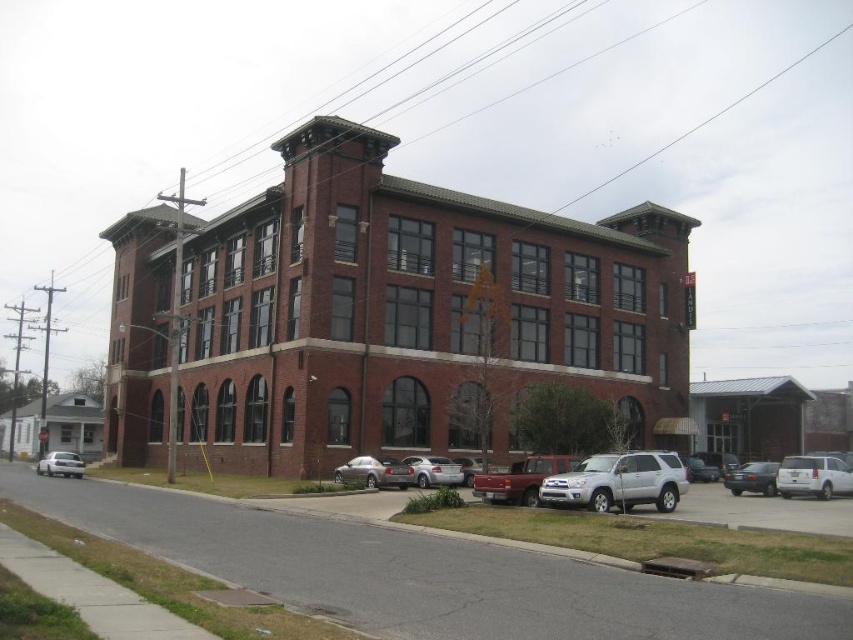
Which is above, metallic gray sedan at lower right or white matte sedan at lower left?

metallic gray sedan at lower right is higher up.

Can you confirm if metallic gray sedan at lower right is thinner than white matte sedan at lower left?

Yes, metallic gray sedan at lower right is thinner than white matte sedan at lower left.

What are the coordinates of `metallic gray sedan at lower right` in the screenshot? It's located at (752, 477).